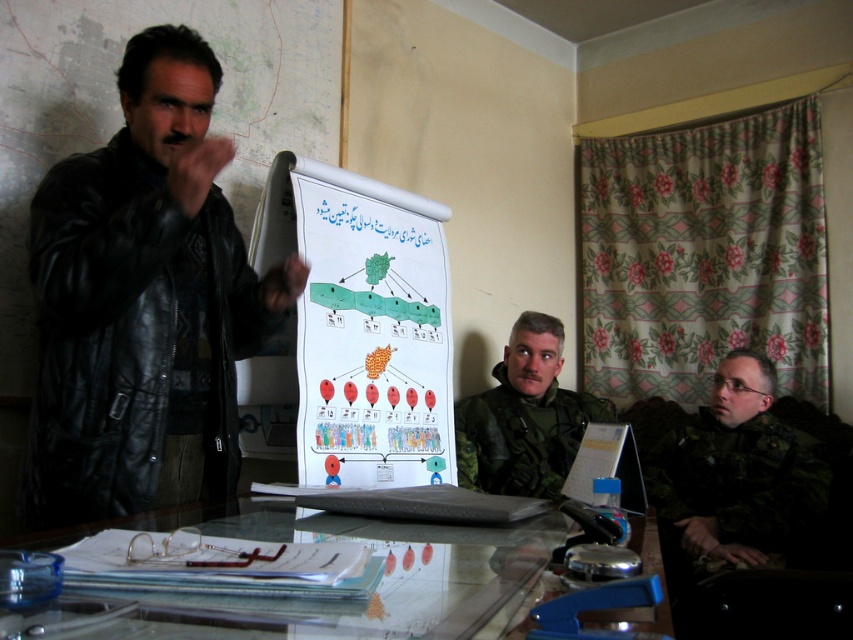
You are a guest in this meeting room and want to place a small notebook on the transparent glass table at center without blocking the view of the camouflage uniform at right. Is this possible?

The transparent glass table at center is closer to the viewer than the camouflage uniform at right, so placing the notebook on the table will not block the view of the camouflage uniform at right since the table is in front of it.

You are a delivery person who needs to place a 1.5 meter long package between the transparent glass table at center and the camouflage uniform at right. Is there enough space to fit the package horizontally between them?

The transparent glass table at center and camouflage uniform at right are 1.38 meters apart. Since the package is 1.5 meters long, it is longer than the available space between them. Therefore, the package cannot be placed horizontally between them.